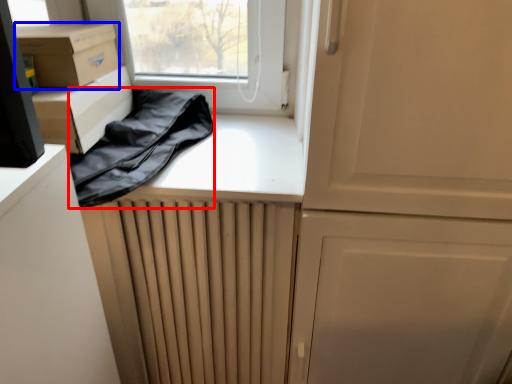
Question: Among these objects, which one is farthest to the camera, clothing (highlighted by a red box) or cardboard box (highlighted by a blue box)?

Choices:
 (A) clothing
 (B) cardboard box

Answer: (B)